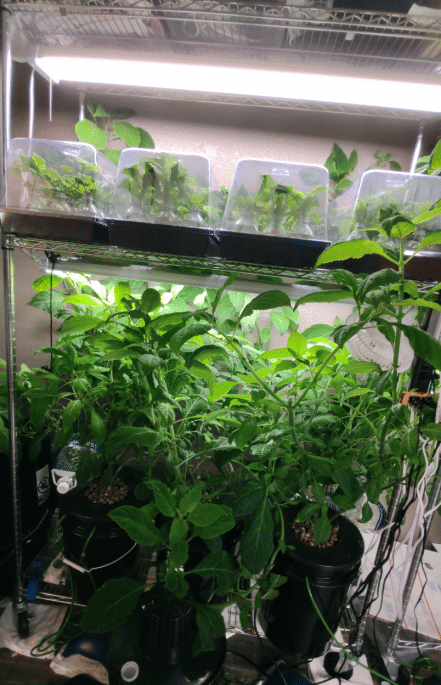
Identify the location of towel. (x=35, y=633).